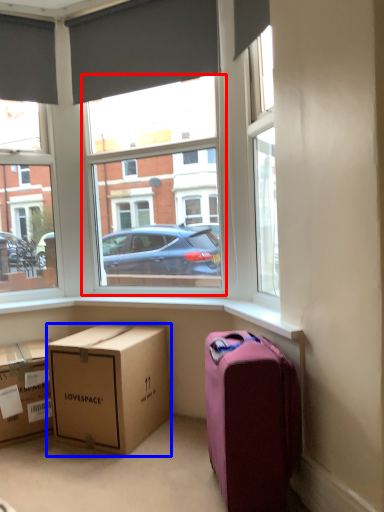
Question: Which object appears closest to the camera in this image, window frame (highlighted by a red box) or box (highlighted by a blue box)?

Choices:
 (A) window frame
 (B) box

Answer: (B)